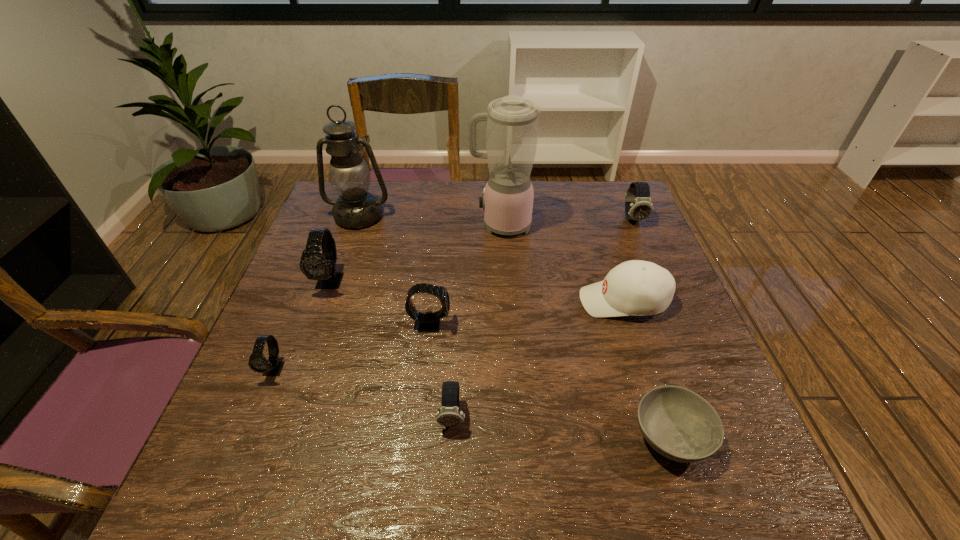
In the image, there is a desktop. Where is `vacant region at the left edge`? The image size is (960, 540). vacant region at the left edge is located at coordinates (285, 411).

Identify the location of free location at the near left corner of the desktop. (273, 459).

Where is `free point at the far right corner`? The width and height of the screenshot is (960, 540). free point at the far right corner is located at coordinates (599, 192).

The width and height of the screenshot is (960, 540). I want to click on vacant point located between the second biggest gray watch and the nearer dark watch, so click(x=442, y=370).

The height and width of the screenshot is (540, 960). Identify the location of vacant area that lies between the smallest gray watch and the baseball cap. (449, 335).

The width and height of the screenshot is (960, 540). What are the coordinates of `free space between the oil lamp and the left dark watch` in the screenshot? It's located at (406, 315).

Identify the location of free spot between the food processor and the bigger dark watch. (567, 222).

You are a GUI agent. You are given a task and a screenshot of the screen. Output one action in this format:
    pyautogui.click(x=<x>, y=<y>)
    Task: Click on the vacant area that lies between the second farthest watch and the left dark watch
    The height and width of the screenshot is (540, 960).
    Given the screenshot: What is the action you would take?
    pyautogui.click(x=392, y=348)

Where is `vacant space in between the left dark watch and the baseball cap`? The height and width of the screenshot is (540, 960). vacant space in between the left dark watch and the baseball cap is located at coordinates (538, 359).

This screenshot has width=960, height=540. I want to click on empty space that is in between the nearest gray watch and the baseball cap, so click(449, 335).